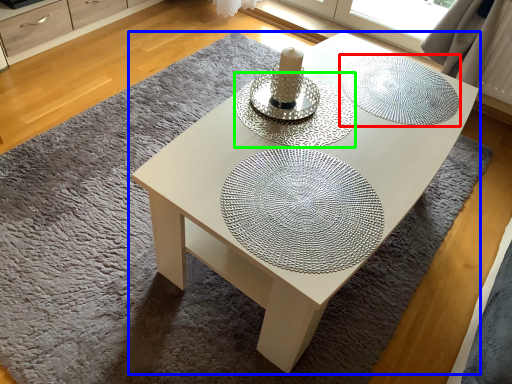
Question: Considering the real-world distances, which object is farthest from glass plate (highlighted by a red box)? coffee table (highlighted by a blue box) or glass plate (highlighted by a green box)?

Choices:
 (A) coffee table
 (B) glass plate

Answer: (B)